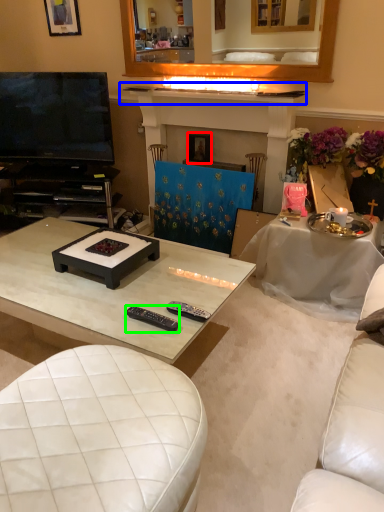
Question: Based on their relative distances, which object is farther from picture frame (highlighted by a red box)? Choose from mantle (highlighted by a blue box) and remote control (highlighted by a green box).

Choices:
 (A) mantle
 (B) remote control

Answer: (B)